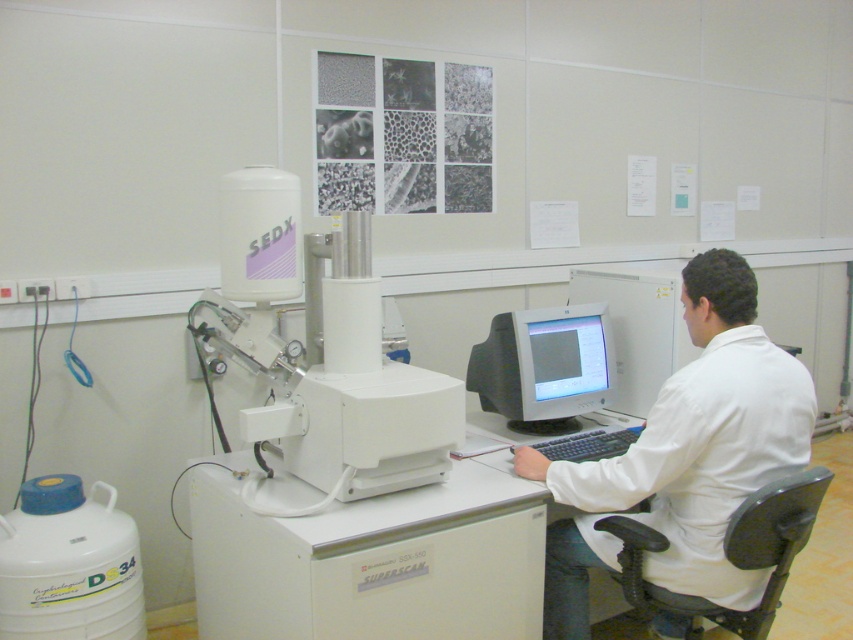
Between white lab coat at center and matte gray monitor at center, which one is positioned lower?

white lab coat at center

Measure the distance from white lab coat at center to matte gray monitor at center.

white lab coat at center is 18.63 inches from matte gray monitor at center.

Looking at this image, who is more forward, [589,628] or [587,410]?

Point [589,628] is more forward.

I want to click on white lab coat at center, so click(683, 456).

Who is positioned more to the right, white plastic table at center or white lab coat at center?

From the viewer's perspective, white lab coat at center appears more on the right side.

Is white plastic table at center thinner than white lab coat at center?

Incorrect, white plastic table at center's width is not less than white lab coat at center's.

Describe the element at coordinates (372, 561) in the screenshot. I see `white plastic table at center` at that location.

Where is `white plastic table at center`? This screenshot has width=853, height=640. white plastic table at center is located at coordinates (372, 561).

Does white plastic table at center appear under matte gray monitor at center?

Correct, white plastic table at center is located below matte gray monitor at center.

Who is higher up, white plastic table at center or matte gray monitor at center?

matte gray monitor at center

Which is behind, point (485, 490) or point (589, 410)?

The point (589, 410) is behind.

The width and height of the screenshot is (853, 640). I want to click on white plastic table at center, so click(372, 561).